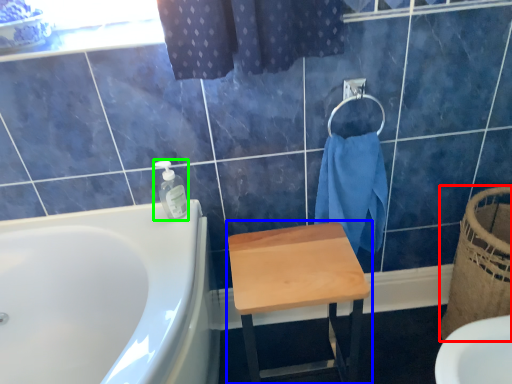
Question: Which is nearer to the basket (highlighted by a red box)? stool (highlighted by a blue box) or soap dispenser (highlighted by a green box).

Choices:
 (A) stool
 (B) soap dispenser

Answer: (A)